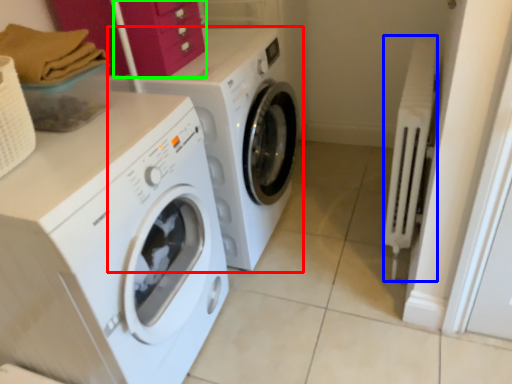
Question: Based on their relative distances, which object is nearer to washing machine (highlighted by a red box)? Choose from radiator (highlighted by a blue box) and drawer (highlighted by a green box).

Choices:
 (A) radiator
 (B) drawer

Answer: (B)